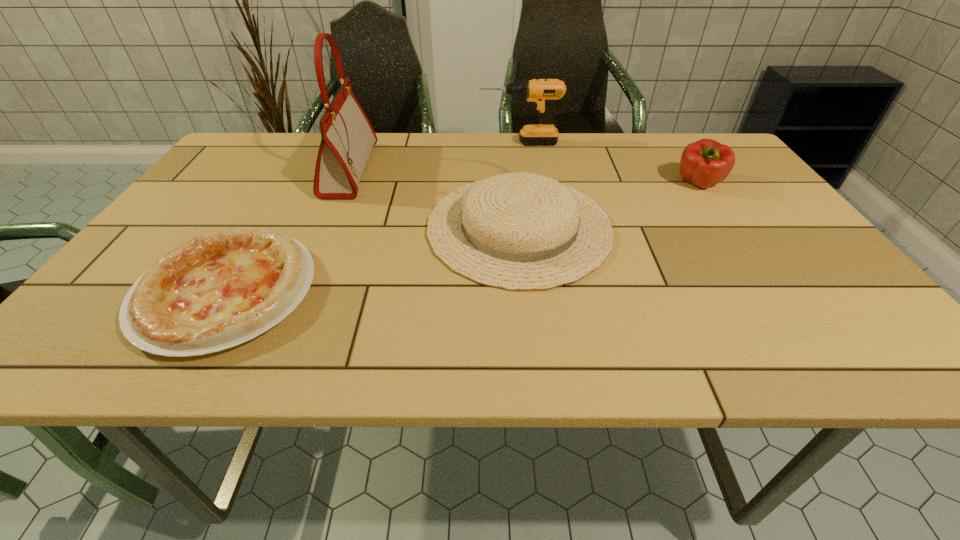
The image size is (960, 540). I want to click on free space located 0.270m on the front of the third tallest object, so click(757, 269).

At what (x,y) coordinates should I click in order to perform the action: click on free spot located 0.110m on the back of the second shortest object. Please return your answer as a coordinate pair (x, y). The width and height of the screenshot is (960, 540). Looking at the image, I should click on (512, 160).

At what (x,y) coordinates should I click in order to perform the action: click on free region located 0.120m on the back of the pizza. Please return your answer as a coordinate pair (x, y). This screenshot has width=960, height=540. Looking at the image, I should click on (276, 208).

I want to click on handbag at the far edge, so click(347, 138).

Where is `drill that is positioned at the far edge`? The width and height of the screenshot is (960, 540). drill that is positioned at the far edge is located at coordinates (541, 92).

Locate an element on the screen. The height and width of the screenshot is (540, 960). bell pepper that is at the far edge is located at coordinates (706, 162).

At what (x,y) coordinates should I click in order to perform the action: click on object that is at the near edge. Please return your answer as a coordinate pair (x, y). This screenshot has width=960, height=540. Looking at the image, I should click on (220, 289).

Locate an element on the screen. object that is at the left edge is located at coordinates (220, 289).

Find the location of a particular element. This screenshot has height=540, width=960. object situated at the right edge is located at coordinates (706, 162).

Locate an element on the screen. The height and width of the screenshot is (540, 960). object located at the near left corner is located at coordinates (220, 289).